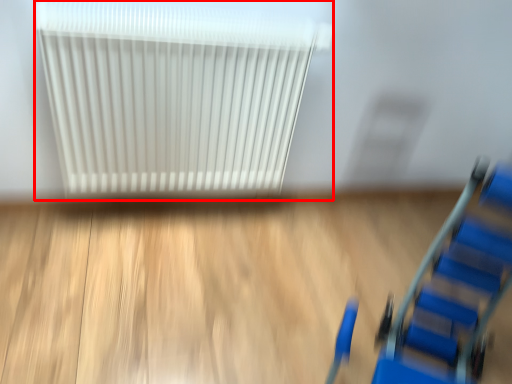
Question: Considering the relative positions of radiator (annotated by the red box) and furniture in the image provided, where is radiator (annotated by the red box) located with respect to the staircase?

Choices:
 (A) left
 (B) right

Answer: (A)